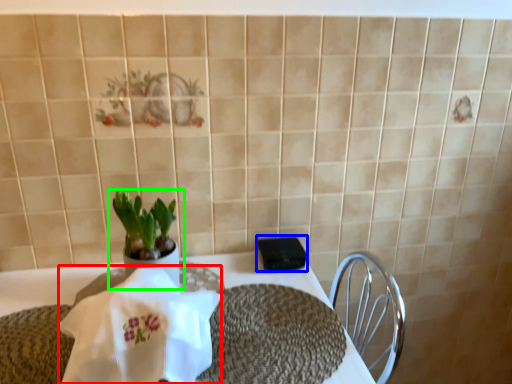
Question: Which object is positioned closest to cloth (highlighted by a red box)? Select from tableware (highlighted by a blue box) and houseplant (highlighted by a green box).

Choices:
 (A) tableware
 (B) houseplant

Answer: (B)